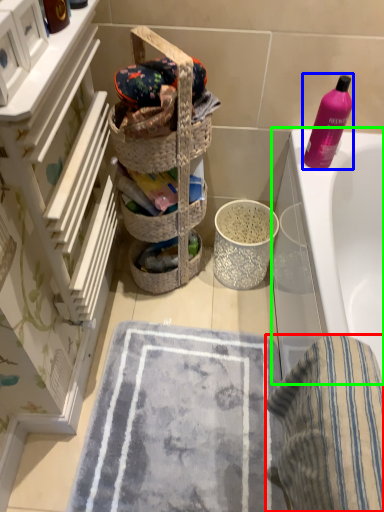
Question: Which object is the farthest from beach towel (highlighted by a red box)? Choose among these: cleaning product (highlighted by a blue box) or bathtub (highlighted by a green box).

Choices:
 (A) cleaning product
 (B) bathtub

Answer: (A)